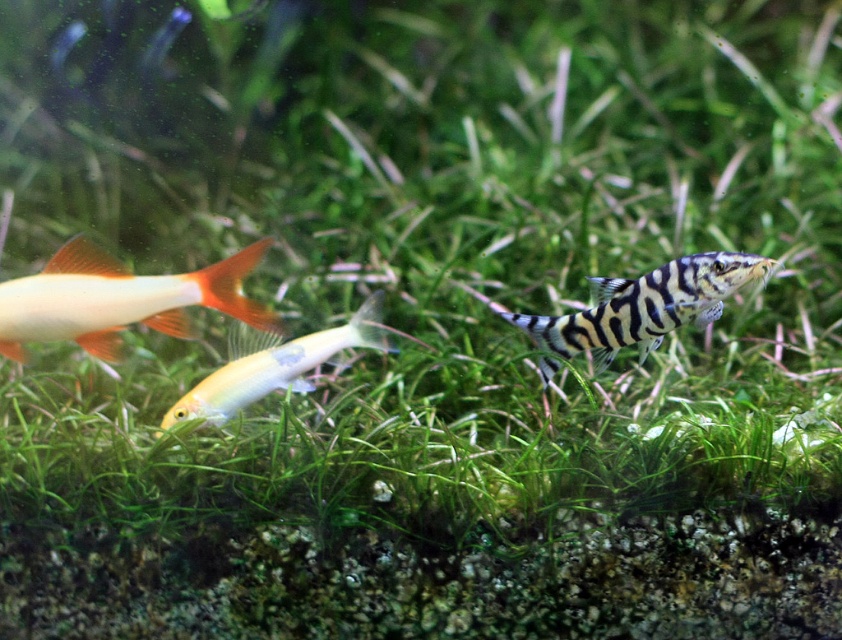
Question: Based on their relative distances, which object is farther from the shiny yellow fish at center?

Choices:
 (A) shiny orange fish at left
 (B) black and white striped fish at center

Answer: (B)

Question: Which point is closer to the camera?

Choices:
 (A) (153, 324)
 (B) (659, 276)
 (C) (366, 312)

Answer: (B)

Question: Among these points, which one is farthest from the camera?

Choices:
 (A) (537, 330)
 (B) (145, 307)

Answer: (B)

Question: Does black and white striped fish at center have a greater width compared to shiny yellow fish at center?

Choices:
 (A) yes
 (B) no

Answer: (B)

Question: Considering the relative positions of shiny orange fish at left and shiny yellow fish at center in the image provided, where is shiny orange fish at left located with respect to shiny yellow fish at center?

Choices:
 (A) right
 (B) left

Answer: (B)

Question: Is black and white striped fish at center thinner than shiny yellow fish at center?

Choices:
 (A) yes
 (B) no

Answer: (A)